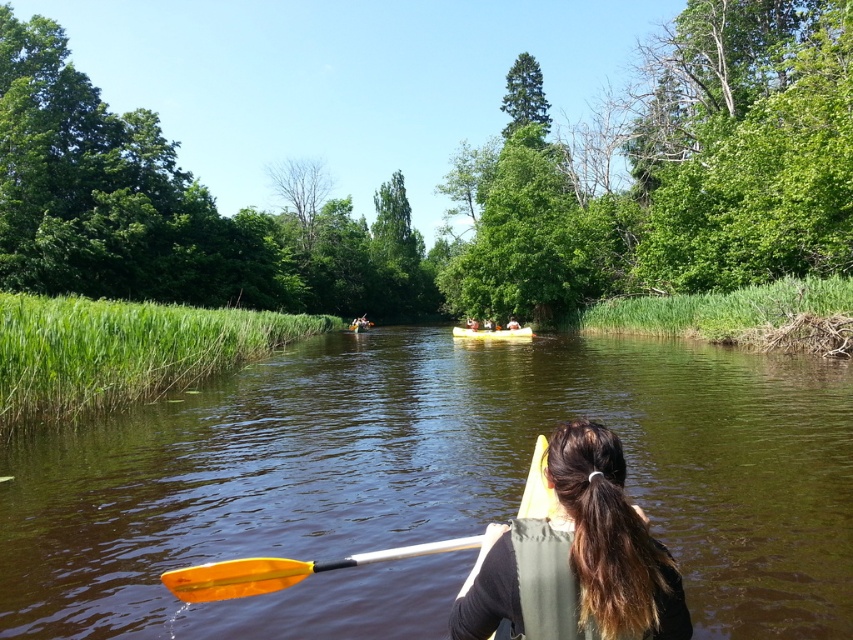
Question: Which of the following is the closest to the observer?

Choices:
 (A) (206, 456)
 (B) (256, 563)
 (C) (625, 600)

Answer: (C)

Question: Does dark brown hair at center appear on the right side of wooden canoe at center?

Choices:
 (A) no
 (B) yes

Answer: (A)

Question: Which point is farther to the camera?

Choices:
 (A) wooden canoe at center
 (B) yellow plastic canoe at center
 (C) brown smooth water at center
 (D) dark brown hair at center

Answer: (B)

Question: Can you confirm if wooden canoe at center is positioned above yellow plastic canoe at center?

Choices:
 (A) yes
 (B) no

Answer: (B)

Question: Is dark brown hair at center wider than wooden canoe at center?

Choices:
 (A) yes
 (B) no

Answer: (B)

Question: Which of the following is the farthest from the observer?

Choices:
 (A) (80, 525)
 (B) (543, 636)
 (C) (474, 339)
 (D) (363, 328)

Answer: (D)